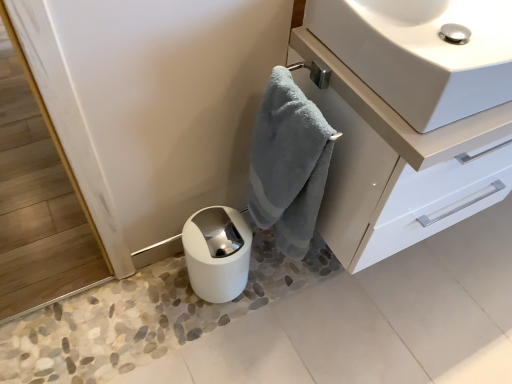
Question: Does glossy white cabinet at upper right appear on the left side of white glossy paper towel at lower center?

Choices:
 (A) no
 (B) yes

Answer: (A)

Question: Can you confirm if glossy white cabinet at upper right is wider than white glossy paper towel at lower center?

Choices:
 (A) yes
 (B) no

Answer: (A)

Question: Is the position of glossy white cabinet at upper right more distant than that of white glossy paper towel at lower center?

Choices:
 (A) no
 (B) yes

Answer: (A)

Question: From a real-world perspective, is glossy white cabinet at upper right positioned over white glossy paper towel at lower center based on gravity?

Choices:
 (A) yes
 (B) no

Answer: (A)

Question: Considering the relative sizes of glossy white cabinet at upper right and white glossy paper towel at lower center in the image provided, is glossy white cabinet at upper right shorter than white glossy paper towel at lower center?

Choices:
 (A) no
 (B) yes

Answer: (A)

Question: Considering the relative sizes of glossy white cabinet at upper right and white glossy paper towel at lower center in the image provided, is glossy white cabinet at upper right bigger than white glossy paper towel at lower center?

Choices:
 (A) yes
 (B) no

Answer: (A)

Question: Is soft blue towel at center oriented towards glossy white cabinet at upper right?

Choices:
 (A) yes
 (B) no

Answer: (B)

Question: Is the surface of soft blue towel at center in direct contact with glossy white cabinet at upper right?

Choices:
 (A) no
 (B) yes

Answer: (A)

Question: Is soft blue towel at center to the left of glossy white cabinet at upper right from the viewer's perspective?

Choices:
 (A) no
 (B) yes

Answer: (B)

Question: From the image's perspective, is soft blue towel at center beneath glossy white cabinet at upper right?

Choices:
 (A) yes
 (B) no

Answer: (A)

Question: Considering the relative positions of soft blue towel at center and glossy white cabinet at upper right in the image provided, is soft blue towel at center to the right of glossy white cabinet at upper right from the viewer's perspective?

Choices:
 (A) no
 (B) yes

Answer: (A)

Question: Is soft blue towel at center positioned with its back to glossy white cabinet at upper right?

Choices:
 (A) yes
 (B) no

Answer: (A)

Question: From a real-world perspective, does soft blue towel at center stand above white glossy sink at upper right?

Choices:
 (A) yes
 (B) no

Answer: (B)